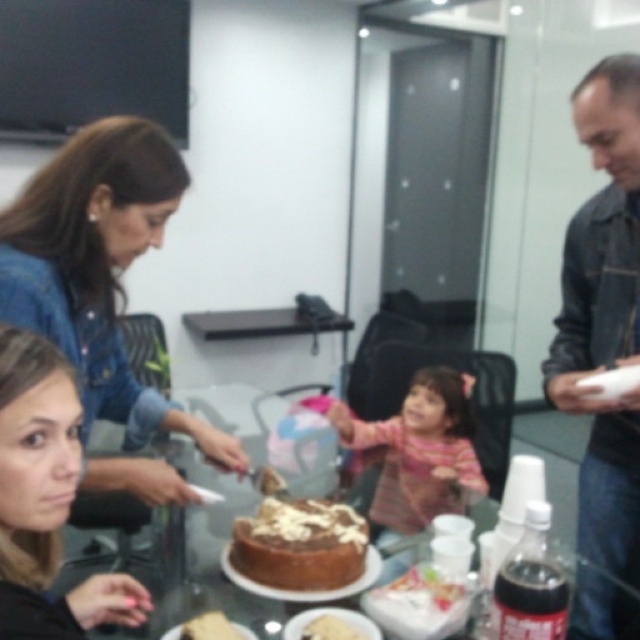
Question: Which object appears farthest from the camera in this image?

Choices:
 (A) denim jacket at upper right
 (B) chocolate cake at center
 (C) white creamy cake at center

Answer: (A)

Question: Can you confirm if chocolatesmoothcake at center is positioned to the right of white creamy cake at center?

Choices:
 (A) no
 (B) yes

Answer: (A)

Question: Can you confirm if chocolate cake at center is thinner than white creamy cake at center?

Choices:
 (A) yes
 (B) no

Answer: (A)

Question: Among these objects, which one is farthest from the camera?

Choices:
 (A) striped fabric at center
 (B) smooth skin face at lower left
 (C) chocolate cake at center

Answer: (A)

Question: Can you confirm if denim jacket at upper right is positioned to the left of white creamy cake at center?

Choices:
 (A) yes
 (B) no

Answer: (B)

Question: Which of the following is the closest to the observer?

Choices:
 (A) denim jacket at upper left
 (B) smooth skin face at lower left
 (C) denim jacket at upper right
 (D) striped fabric at center

Answer: (B)